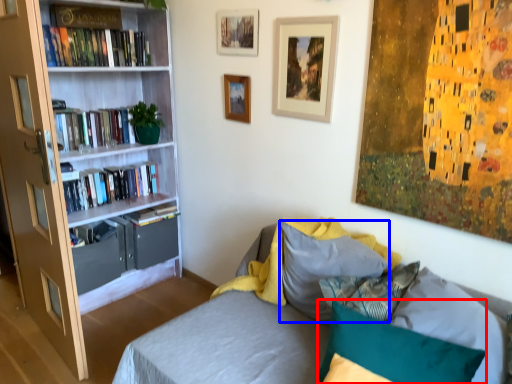
Question: Which object is further to the camera taking this photo, pillow (highlighted by a red box) or pillow (highlighted by a blue box)?

Choices:
 (A) pillow
 (B) pillow

Answer: (B)